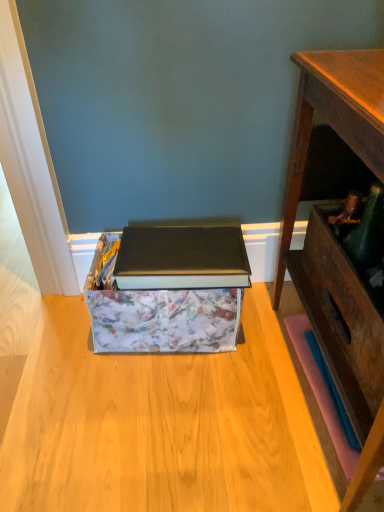
Locate an element on the screen. floral-patterned cardboard box at center is located at coordinates (172, 291).

What do you see at coordinates (172, 291) in the screenshot? I see `floral-patterned cardboard box at center` at bounding box center [172, 291].

Describe the element at coordinates (333, 199) in the screenshot. The image size is (384, 512). I see `wooden desk at right` at that location.

What are the coordinates of `wooden desk at right` in the screenshot? It's located at (333, 199).

Where is `floral-patterned cardboard box at center`? The height and width of the screenshot is (512, 384). floral-patterned cardboard box at center is located at coordinates (172, 291).

Considering the relative positions of floral-patterned cardboard box at center and wooden desk at right in the image provided, is floral-patterned cardboard box at center to the right of wooden desk at right from the viewer's perspective?

No.

Relative to wooden desk at right, is floral-patterned cardboard box at center in front or behind?

Visually, floral-patterned cardboard box at center is located behind wooden desk at right.

Which point is more distant from viewer, (x=140, y=298) or (x=318, y=190)?

The point (x=318, y=190) is behind.

From the image's perspective, is floral-patterned cardboard box at center positioned above or below wooden desk at right?

floral-patterned cardboard box at center is below wooden desk at right.

From a real-world perspective, is floral-patterned cardboard box at center above or below wooden desk at right?

floral-patterned cardboard box at center is below wooden desk at right.

Which object is wider, floral-patterned cardboard box at center or wooden desk at right?

wooden desk at right is wider.

From their relative heights in the image, would you say floral-patterned cardboard box at center is taller or shorter than wooden desk at right?

floral-patterned cardboard box at center is shorter than wooden desk at right.

Based on the photo, which of these two, floral-patterned cardboard box at center or wooden desk at right, is smaller?

With smaller size is floral-patterned cardboard box at center.

Is floral-patterned cardboard box at center located outside wooden desk at right?

Yes.

Is floral-patterned cardboard box at center not near wooden desk at right?

floral-patterned cardboard box at center is near wooden desk at right, not far away.

Is floral-patterned cardboard box at center positioned with its back to wooden desk at right?

floral-patterned cardboard box at center is not turned away from wooden desk at right.

Locate an element on the screen. The height and width of the screenshot is (512, 384). desk above the floral-patterned cardboard box at center (from a real-world perspective) is located at coordinates (333, 199).

Is wooden desk at right to the left or to the right of floral-patterned cardboard box at center in the image?

Based on their positions, wooden desk at right is located to the right of floral-patterned cardboard box at center.

Which object is more forward, wooden desk at right or floral-patterned cardboard box at center?

wooden desk at right is more forward.

Is point (367, 102) positioned in front of point (215, 243)?

That is True.

From the image's perspective, is wooden desk at right located beneath floral-patterned cardboard box at center?

Actually, wooden desk at right appears above floral-patterned cardboard box at center in the image.

In the scene shown: From a real-world perspective, is wooden desk at right on floral-patterned cardboard box at center?

Yes.

Can you confirm if wooden desk at right is thinner than floral-patterned cardboard box at center?

No.

Consider the image. Between wooden desk at right and floral-patterned cardboard box at center, which one has less height?

floral-patterned cardboard box at center.

Between wooden desk at right and floral-patterned cardboard box at center, which one has smaller size?

floral-patterned cardboard box at center is smaller.

Is floral-patterned cardboard box at center a part of wooden desk at right?

No, floral-patterned cardboard box at center is located outside of wooden desk at right.

Are wooden desk at right and floral-patterned cardboard box at center making contact?

No, wooden desk at right is not next to floral-patterned cardboard box at center.

Is wooden desk at right aimed at floral-patterned cardboard box at center?

Yes, wooden desk at right is oriented towards floral-patterned cardboard box at center.

You are a GUI agent. You are given a task and a screenshot of the screen. Output one action in this format:
    pyautogui.click(x=<x>, y=<y>)
    Task: Click on the desk lying on the right of floral-patterned cardboard box at center
    
    Given the screenshot: What is the action you would take?
    pyautogui.click(x=333, y=199)

At what (x,y) coordinates should I click in order to perform the action: click on cardboard box behind the wooden desk at right. Please return your answer as a coordinate pair (x, y). Looking at the image, I should click on tap(172, 291).

I want to click on desk on the right of floral-patterned cardboard box at center, so [x=333, y=199].